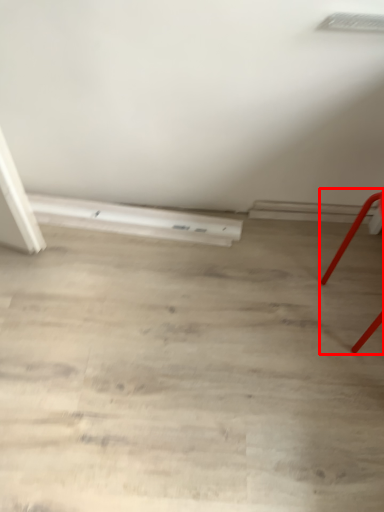
Question: Considering the relative positions of furniture (annotated by the red box) and plank in the image provided, where is furniture (annotated by the red box) located with respect to the staircase?

Choices:
 (A) right
 (B) left

Answer: (A)